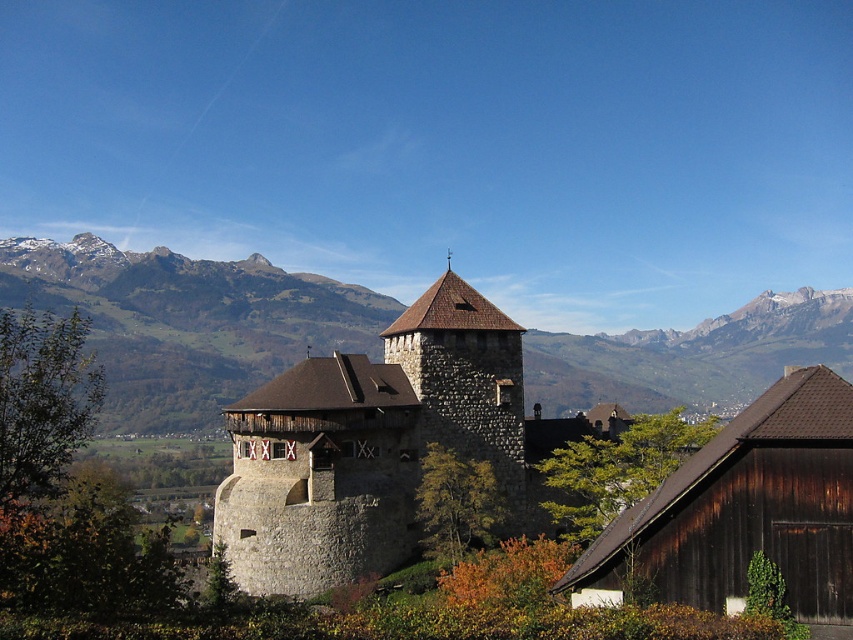
You are an architect planning to build a new observation deck. You need to choose between the brown stone tower at center and the brown rocky mountain range at upper center as a base. Which location offers a wider base for construction?

The brown rocky mountain range at upper center offers a wider base for construction since its width surpasses that of the brown stone tower at center.

You are a hiker planning to take a photo of the stone tower at center and the brown rocky mountain range at upper center. Which one of these two objects will appear wider in your photo?

The brown rocky mountain range at upper center appears wider than the stone tower at center in the photo because its width surpasses that of the tower.